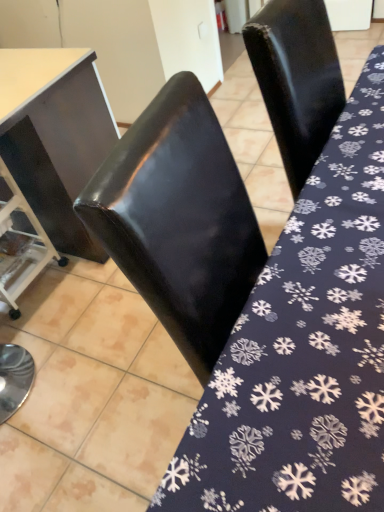
The width and height of the screenshot is (384, 512). What do you see at coordinates (304, 349) in the screenshot?
I see `dark blue fabric with snowflake pattern at center` at bounding box center [304, 349].

Identify the location of dark blue fabric with snowflake pattern at center. (304, 349).

In order to face dark blue fabric with snowflake pattern at center, should I rotate leftwards or rightwards?

You should rotate right by 20.825 degrees.

Consider the image. Measure the distance between point (286, 483) and camera.

The distance of point (286, 483) from camera is 23.11 inches.

Where is `dark blue fabric with snowflake pattern at center`? The image size is (384, 512). dark blue fabric with snowflake pattern at center is located at coordinates (304, 349).